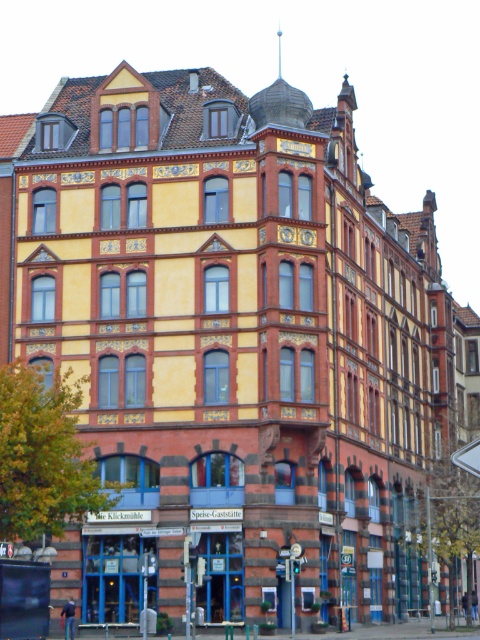
Question: Does white plastic street sign at lower right come in front of metallic pole at center?

Choices:
 (A) no
 (B) yes

Answer: (B)

Question: Among these points, which one is farthest from the camera?

Choices:
 (A) (295, 621)
 (B) (453, 456)

Answer: (B)

Question: Does white plastic street sign at lower right have a lesser width compared to metallic pole at center?

Choices:
 (A) yes
 (B) no

Answer: (B)

Question: Does white plastic street sign at lower right appear on the left side of metallic pole at center?

Choices:
 (A) no
 (B) yes

Answer: (A)

Question: Which point is closer to the camera taking this photo?

Choices:
 (A) (456, 456)
 (B) (291, 628)

Answer: (A)